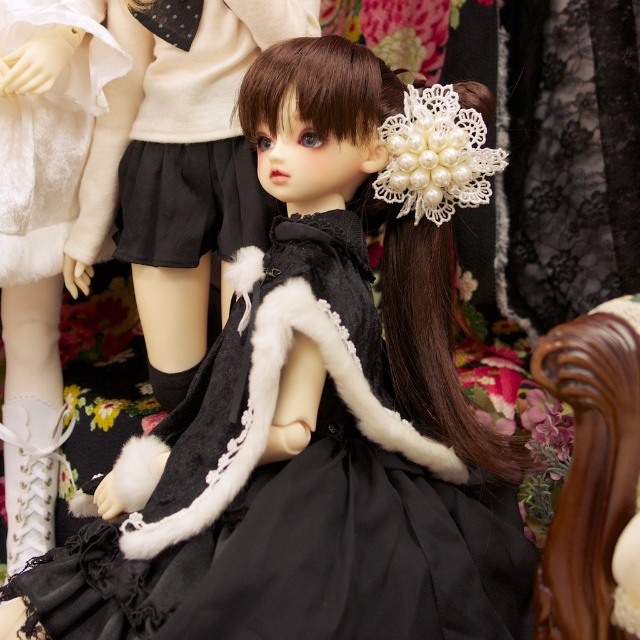
Question: Can you confirm if white fur boots at lower left is positioned to the left of white satin dress at upper left?

Choices:
 (A) no
 (B) yes

Answer: (B)

Question: Which point appears farthest from the camera in this image?

Choices:
 (A) (26, 365)
 (B) (621, 369)

Answer: (A)

Question: Can you confirm if white fur boots at lower left is positioned below brown polished wood chair at right?

Choices:
 (A) yes
 (B) no

Answer: (B)

Question: Observing the image, what is the correct spatial positioning of white fur boots at lower left in reference to white satin dress at upper left?

Choices:
 (A) above
 (B) below

Answer: (B)

Question: Estimate the real-world distances between objects in this image. Which object is closer to the black matte skirt at upper left?

Choices:
 (A) white satin dress at upper left
 (B) white fur boots at lower left

Answer: (A)

Question: Among these points, which one is farthest from the camera?

Choices:
 (A) (93, 0)
 (B) (634, 413)
 (C) (49, 52)

Answer: (A)